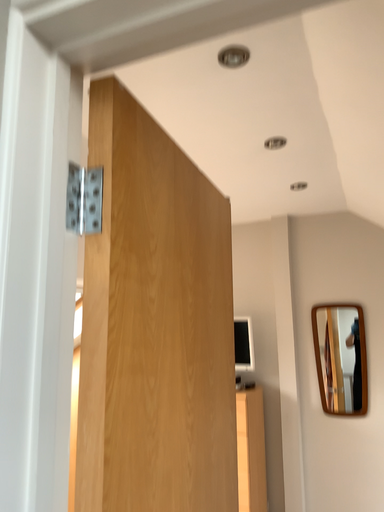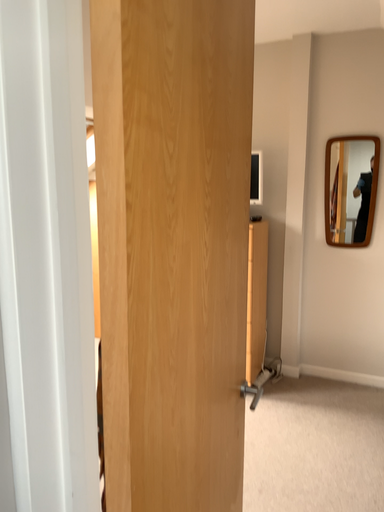
Question: How did the camera likely rotate when shooting the video?

Choices:
 (A) rotated downward
 (B) rotated upward

Answer: (A)